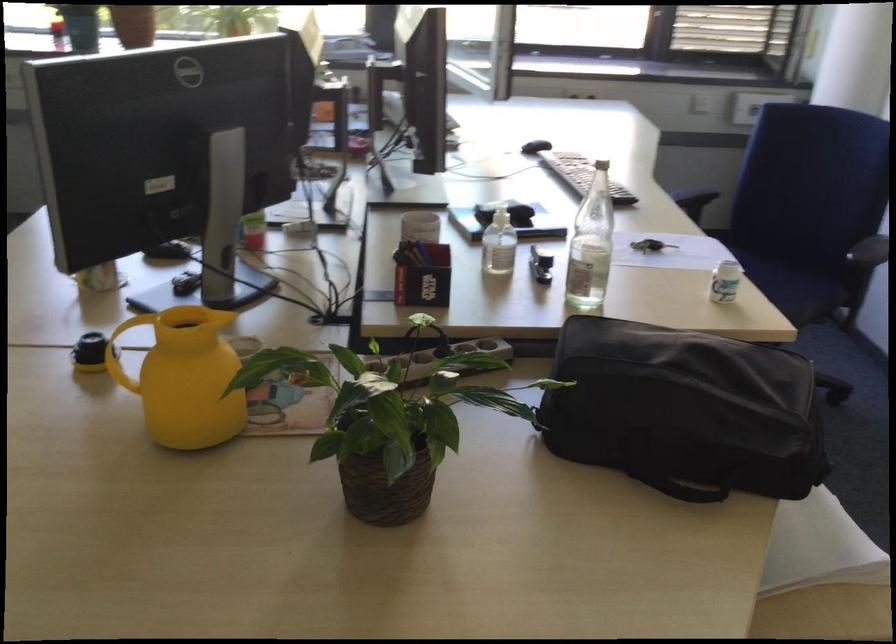
Describe the element at coordinates (124, 337) in the screenshot. This screenshot has width=896, height=644. I see `the yellow pitcher handle` at that location.